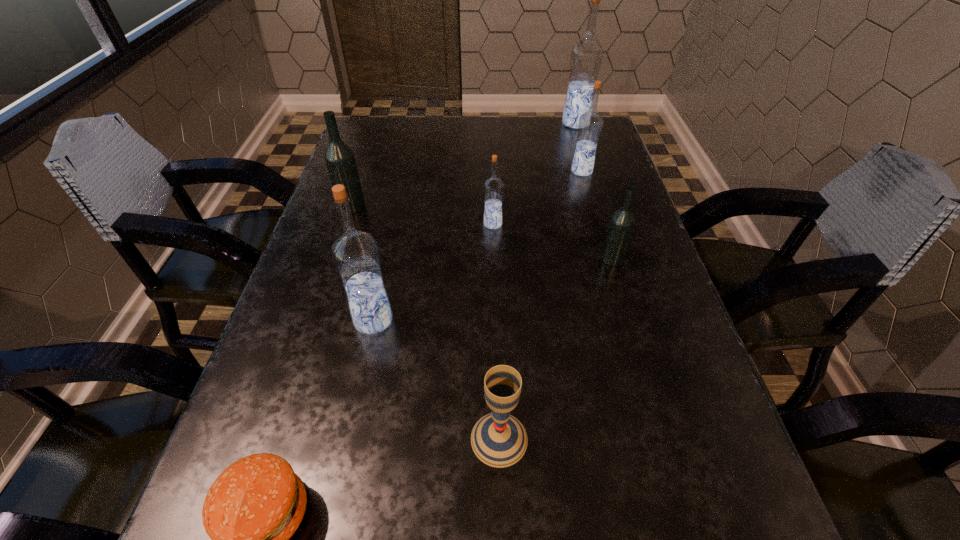
Identify the location of the closest blue vodka to the third blue vodka from right to left. This screenshot has height=540, width=960. (590, 123).